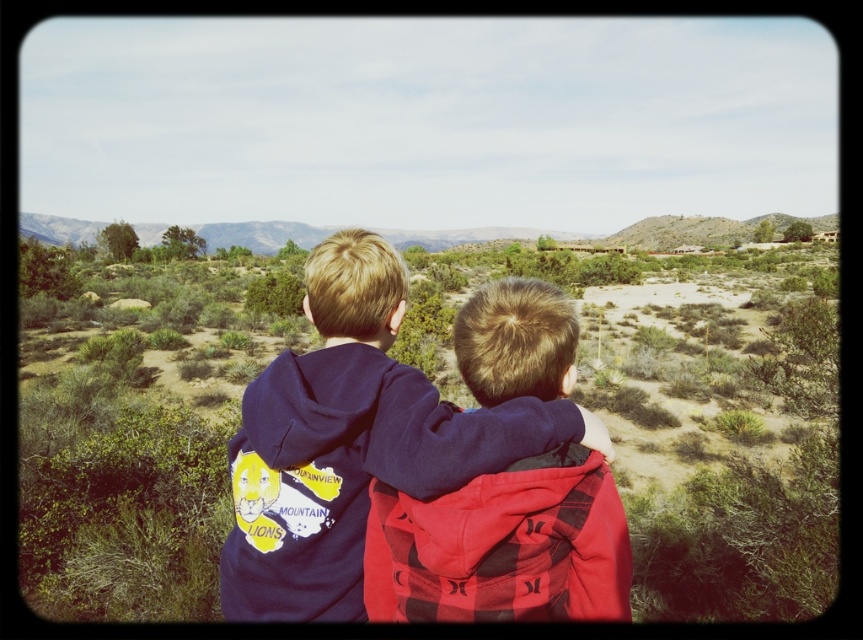
Question: Does green shrubs at center have a lesser width compared to matte blue hoodie at center?

Choices:
 (A) yes
 (B) no

Answer: (B)

Question: Is green shrubs at center closer to the viewer compared to matte blue hoodie at center?

Choices:
 (A) yes
 (B) no

Answer: (B)

Question: Which object appears farthest from the camera in this image?

Choices:
 (A) matte blue hoodie at center
 (B) green shrubs at center

Answer: (B)

Question: Which point appears farthest from the camera in this image?

Choices:
 (A) (331, 472)
 (B) (406, 616)

Answer: (A)

Question: Can you confirm if green shrubs at center is bigger than matte blue hoodie at center?

Choices:
 (A) no
 (B) yes

Answer: (B)

Question: Which object appears closest to the camera in this image?

Choices:
 (A) matte blue hoodie at center
 (B) green shrubs at center

Answer: (A)